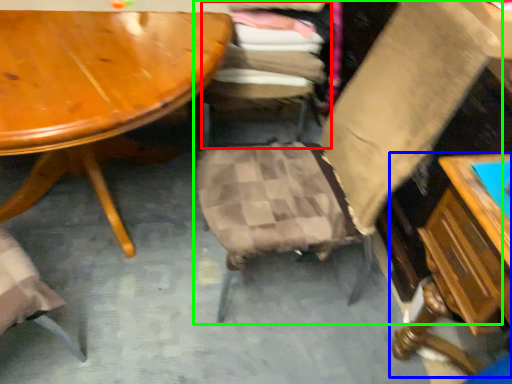
Question: Which object is positioned closest to chair (highlighted by a red box)? Select from table (highlighted by a blue box) and chair (highlighted by a green box).

Choices:
 (A) table
 (B) chair

Answer: (B)